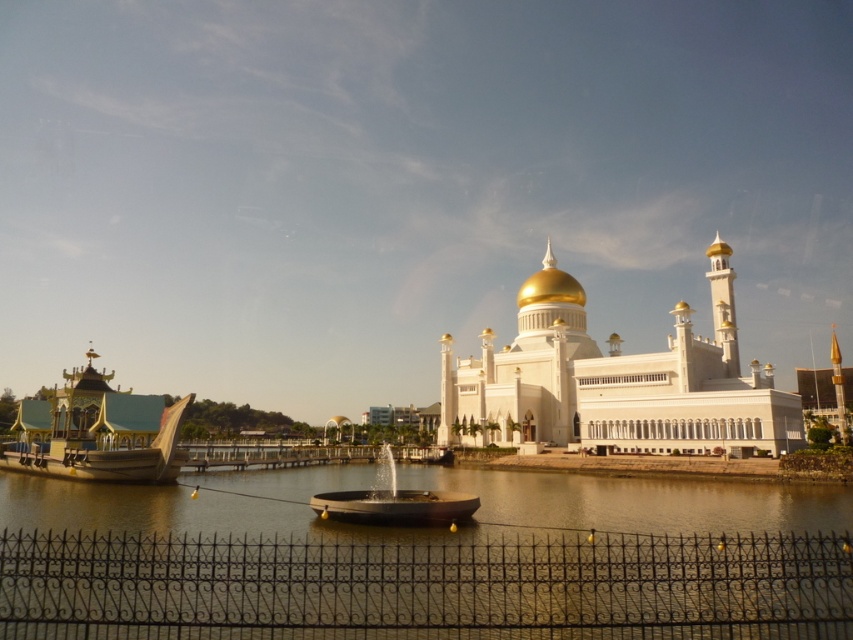
Is point (761, 400) less distant than point (163, 413)?

Yes, it is in front of point (163, 413).

Which is more to the left, white glossy mosque at center or gold polished wood boat at left?

From the viewer's perspective, gold polished wood boat at left appears more on the left side.

Between point (674, 394) and point (105, 378), which one is positioned behind?

The point (105, 378) is behind.

This screenshot has height=640, width=853. Find the location of `white glossy mosque at center`. white glossy mosque at center is located at coordinates [x=614, y=381].

Measure the distance between black wrought iron fence at lower center and white glossy mosque at center.

A distance of 48.29 meters exists between black wrought iron fence at lower center and white glossy mosque at center.

Can you confirm if black wrought iron fence at lower center is smaller than white glossy mosque at center?

Yes.

Measure the distance between black wrought iron fence at lower center and camera.

black wrought iron fence at lower center and camera are 40.39 meters apart from each other.

You are a GUI agent. You are given a task and a screenshot of the screen. Output one action in this format:
    pyautogui.click(x=<x>, y=<y>)
    Task: Click on the black wrought iron fence at lower center
    
    Given the screenshot: What is the action you would take?
    pyautogui.click(x=425, y=586)

Who is shorter, black wrought iron fence at lower center or gold polished wood boat at left?

black wrought iron fence at lower center

Does black wrought iron fence at lower center appear on the right side of gold polished wood boat at left?

→ Correct, you'll find black wrought iron fence at lower center to the right of gold polished wood boat at left.

Is point (21, 548) positioned behind point (51, 444)?

That is False.

At what (x,y) coordinates should I click in order to perform the action: click on black wrought iron fence at lower center. Please return your answer as a coordinate pair (x, y). The image size is (853, 640). Looking at the image, I should click on (425, 586).